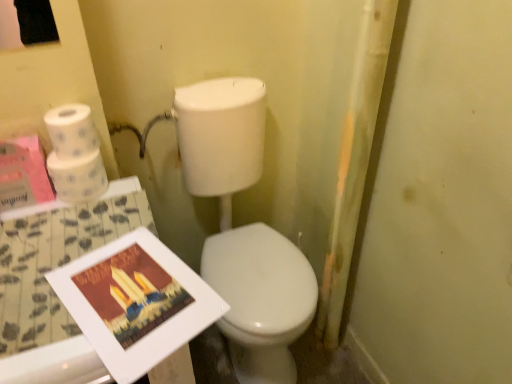
The image size is (512, 384). In order to click on free space above white glossy table at lower left (from a real-world perspective) in this screenshot , I will do `click(67, 272)`.